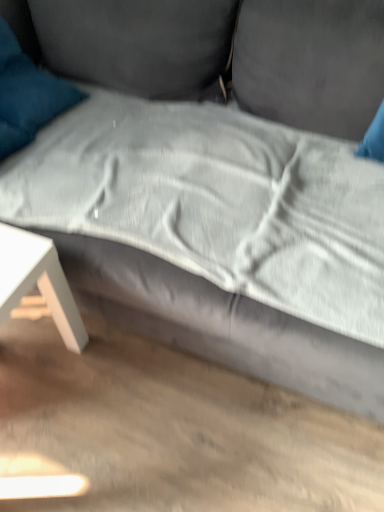
The image size is (384, 512). I want to click on unoccupied region to the right of white matte table at lower left, so click(110, 402).